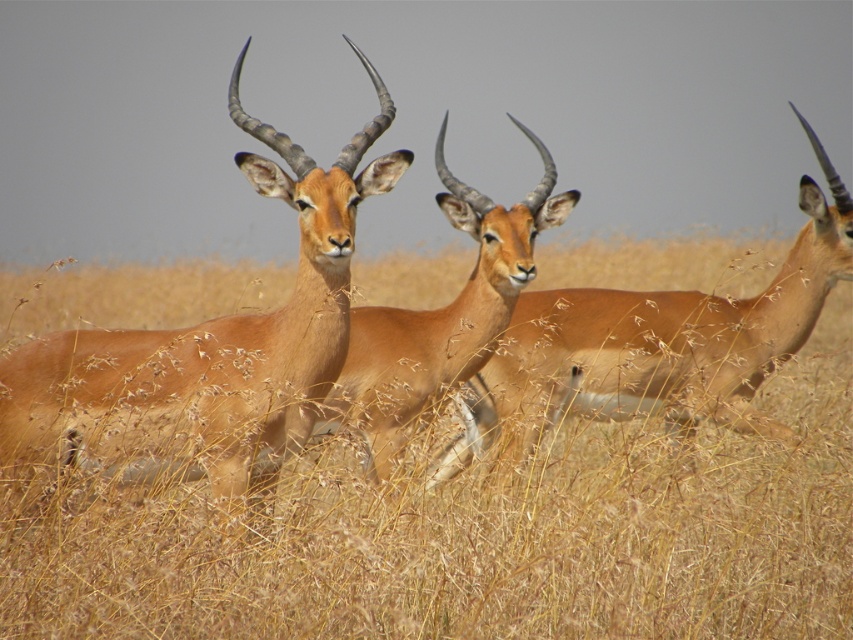
You are a wildlife photographer standing in the savanna with your camera. You want to capture a close shot of the brown glossy antelope at center. Given that your camera can focus on subjects within 3 meters, will you need to move closer or farther away to get a clear close shot?

The brown glossy antelope at center is 4.06 meters away from you. Since your camera can focus within 3 meters, you need to move closer to within 3 meters to get a clear close shot.

You are standing at the origin point in the image and want to move towards the point marked as point (474, 536). Based on the scene description, what will you encounter when you reach that point?

When you reach point (474, 536), you will encounter brown dry grass at center, as the coordinates correspond to that location according to the scene description.